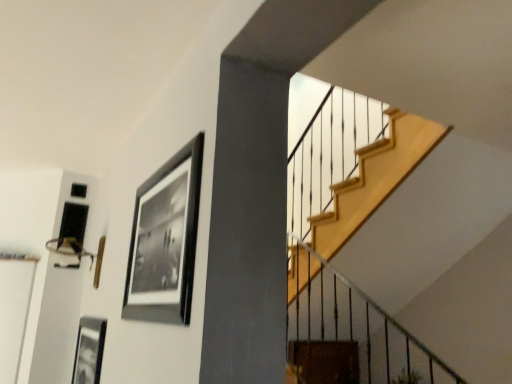
What do you see at coordinates (165, 240) in the screenshot? I see `black matte picture frame at upper left, which ranks as the first picture frame in right-to-left order` at bounding box center [165, 240].

Find the location of a particular element. This screenshot has width=512, height=384. black matte picture frame at upper left, which ranks as the first picture frame in right-to-left order is located at coordinates (165, 240).

Locate an element on the screen. The height and width of the screenshot is (384, 512). black matte picture frame at lower left, marked as the 2th picture frame in a front-to-back arrangement is located at coordinates (89, 351).

This screenshot has width=512, height=384. What do you see at coordinates (89, 351) in the screenshot?
I see `black matte picture frame at lower left, placed as the 1th picture frame when sorted from left to right` at bounding box center [89, 351].

This screenshot has height=384, width=512. I want to click on black matte picture frame at upper left, which ranks as the second picture frame in bottom-to-top order, so click(165, 240).

Can you confirm if black matte picture frame at lower left, arranged as the 1th picture frame when ordered from the bottom, is positioned to the left of black matte picture frame at upper left, which is the first picture frame from top to bottom?

Yes, black matte picture frame at lower left, arranged as the 1th picture frame when ordered from the bottom, is to the left of black matte picture frame at upper left, which is the first picture frame from top to bottom.

Which is behind, black matte picture frame at lower left, arranged as the 1th picture frame when ordered from the bottom, or black matte picture frame at upper left, which ranks as the first picture frame in front-to-back order?

Positioned behind is black matte picture frame at lower left, arranged as the 1th picture frame when ordered from the bottom.

Which is less distant, [96,376] or [156,218]?

Point [96,376] is positioned farther from the camera compared to point [156,218].

From the image's perspective, between black matte picture frame at lower left, arranged as the second picture frame when viewed from the top, and black matte picture frame at upper left, which ranks as the first picture frame in right-to-left order, who is located below?

black matte picture frame at lower left, arranged as the second picture frame when viewed from the top, from the image's perspective.

From a real-world perspective, which is physically above, black matte picture frame at lower left, arranged as the second picture frame when viewed from the top, or black matte picture frame at upper left, which ranks as the first picture frame in front-to-back order?

In real-world perspective, black matte picture frame at upper left, which ranks as the first picture frame in front-to-back order, is above.

In terms of width, does black matte picture frame at lower left, arranged as the second picture frame when viewed from the top, look wider or thinner when compared to black matte picture frame at upper left, which ranks as the first picture frame in front-to-back order?

Clearly, black matte picture frame at lower left, arranged as the second picture frame when viewed from the top, has less width compared to black matte picture frame at upper left, which ranks as the first picture frame in front-to-back order.

Does black matte picture frame at lower left, which is counted as the 1th picture frame, starting from the back, have a greater height compared to black matte picture frame at upper left, which ranks as the second picture frame in bottom-to-top order?

No, black matte picture frame at lower left, which is counted as the 1th picture frame, starting from the back, is not taller than black matte picture frame at upper left, which ranks as the second picture frame in bottom-to-top order.

Who is bigger, black matte picture frame at lower left, arranged as the second picture frame when viewed from the top, or black matte picture frame at upper left, which ranks as the first picture frame in front-to-back order?

black matte picture frame at upper left, which ranks as the first picture frame in front-to-back order.

Is black matte picture frame at upper left, which ranks as the second picture frame in bottom-to-top order, surrounded by black matte picture frame at lower left, marked as the 2th picture frame in a front-to-back arrangement?

No, black matte picture frame at upper left, which ranks as the second picture frame in bottom-to-top order, is not inside black matte picture frame at lower left, marked as the 2th picture frame in a front-to-back arrangement.

Is black matte picture frame at lower left, which ranks as the second picture frame in right-to-left order, next to black matte picture frame at upper left, positioned as the 2th picture frame in left-to-right order, and touching it?

No, black matte picture frame at lower left, which ranks as the second picture frame in right-to-left order, is not in contact with black matte picture frame at upper left, positioned as the 2th picture frame in left-to-right order.

Is black matte picture frame at lower left, placed as the 1th picture frame when sorted from left to right, looking in the opposite direction of black matte picture frame at upper left, which ranks as the first picture frame in right-to-left order?

No, black matte picture frame at lower left, placed as the 1th picture frame when sorted from left to right, is not facing the opposite direction of black matte picture frame at upper left, which ranks as the first picture frame in right-to-left order.

How different are the orientations of black matte picture frame at lower left, arranged as the second picture frame when viewed from the top, and black matte picture frame at upper left, which ranks as the second picture frame in bottom-to-top order, in degrees?

The angle between the facing direction of black matte picture frame at lower left, arranged as the second picture frame when viewed from the top, and the facing direction of black matte picture frame at upper left, which ranks as the second picture frame in bottom-to-top order, is 0.00355 degrees.

Identify the location of picture frame above the black matte picture frame at lower left, placed as the 1th picture frame when sorted from left to right (from the image's perspective). The height and width of the screenshot is (384, 512). (165, 240).

Looking at this image, which object is positioned more to the right, black matte picture frame at upper left, which is the first picture frame from top to bottom, or black matte picture frame at lower left, arranged as the 1th picture frame when ordered from the bottom?

black matte picture frame at upper left, which is the first picture frame from top to bottom.

Is black matte picture frame at upper left, which ranks as the first picture frame in front-to-back order, closer to the viewer compared to black matte picture frame at lower left, which is counted as the 1th picture frame, starting from the back?

Yes, black matte picture frame at upper left, which ranks as the first picture frame in front-to-back order, is in front of black matte picture frame at lower left, which is counted as the 1th picture frame, starting from the back.

Is point (191, 175) in front of point (79, 329)?

Yes, it is.

From the image's perspective, would you say black matte picture frame at upper left, which ranks as the second picture frame in bottom-to-top order, is shown under black matte picture frame at lower left, arranged as the second picture frame when viewed from the top?

No.

From a real-world perspective, is black matte picture frame at upper left, which ranks as the first picture frame in front-to-back order, under black matte picture frame at lower left, placed as the 1th picture frame when sorted from left to right?

No, from a real-world perspective, black matte picture frame at upper left, which ranks as the first picture frame in front-to-back order, is not beneath black matte picture frame at lower left, placed as the 1th picture frame when sorted from left to right.

Considering the sizes of black matte picture frame at upper left, positioned as the 2th picture frame in left-to-right order, and black matte picture frame at lower left, which ranks as the second picture frame in right-to-left order, in the image, is black matte picture frame at upper left, positioned as the 2th picture frame in left-to-right order, wider or thinner than black matte picture frame at lower left, which ranks as the second picture frame in right-to-left order,?

In the image, black matte picture frame at upper left, positioned as the 2th picture frame in left-to-right order, appears to be wider than black matte picture frame at lower left, which ranks as the second picture frame in right-to-left order.

Considering the relative sizes of black matte picture frame at upper left, positioned as the 2th picture frame in left-to-right order, and black matte picture frame at lower left, which ranks as the second picture frame in right-to-left order, in the image provided, is black matte picture frame at upper left, positioned as the 2th picture frame in left-to-right order, shorter than black matte picture frame at lower left, which ranks as the second picture frame in right-to-left order,?

No.

Considering the relative sizes of black matte picture frame at upper left, placed as the second picture frame when sorted from back to front, and black matte picture frame at lower left, which is counted as the 1th picture frame, starting from the back, in the image provided, is black matte picture frame at upper left, placed as the second picture frame when sorted from back to front, bigger than black matte picture frame at lower left, which is counted as the 1th picture frame, starting from the back,?

Yes, black matte picture frame at upper left, placed as the second picture frame when sorted from back to front, is bigger than black matte picture frame at lower left, which is counted as the 1th picture frame, starting from the back.

Is black matte picture frame at upper left, which ranks as the second picture frame in bottom-to-top order, spatially inside black matte picture frame at lower left, which ranks as the second picture frame in right-to-left order, or outside of it?

black matte picture frame at upper left, which ranks as the second picture frame in bottom-to-top order, exists outside the volume of black matte picture frame at lower left, which ranks as the second picture frame in right-to-left order.

Looking at this image, are black matte picture frame at upper left, placed as the second picture frame when sorted from back to front, and black matte picture frame at lower left, marked as the 2th picture frame in a front-to-back arrangement, making contact?

No, black matte picture frame at upper left, placed as the second picture frame when sorted from back to front, is not in contact with black matte picture frame at lower left, marked as the 2th picture frame in a front-to-back arrangement.

Is black matte picture frame at upper left, which ranks as the second picture frame in bottom-to-top order, facing towards black matte picture frame at lower left, which is counted as the 1th picture frame, starting from the back?

No, black matte picture frame at upper left, which ranks as the second picture frame in bottom-to-top order, does not turn towards black matte picture frame at lower left, which is counted as the 1th picture frame, starting from the back.

Can you tell me how much black matte picture frame at upper left, which ranks as the first picture frame in front-to-back order, and black matte picture frame at lower left, which ranks as the second picture frame in right-to-left order, differ in facing direction?

0.00355 degrees.

How distant is black matte picture frame at upper left, placed as the second picture frame when sorted from back to front, from black matte picture frame at lower left, marked as the 2th picture frame in a front-to-back arrangement?

black matte picture frame at upper left, placed as the second picture frame when sorted from back to front, and black matte picture frame at lower left, marked as the 2th picture frame in a front-to-back arrangement, are 87.79 centimeters apart from each other.

Locate an element on the screen. The width and height of the screenshot is (512, 384). picture frame to the right of black matte picture frame at lower left, placed as the 1th picture frame when sorted from left to right is located at coordinates (165, 240).

The image size is (512, 384). I want to click on picture frame that is above the black matte picture frame at lower left, placed as the 1th picture frame when sorted from left to right (from a real-world perspective), so click(x=165, y=240).

Find the location of a particular element. picture frame located on the left of black matte picture frame at upper left, which ranks as the first picture frame in right-to-left order is located at coordinates (89, 351).